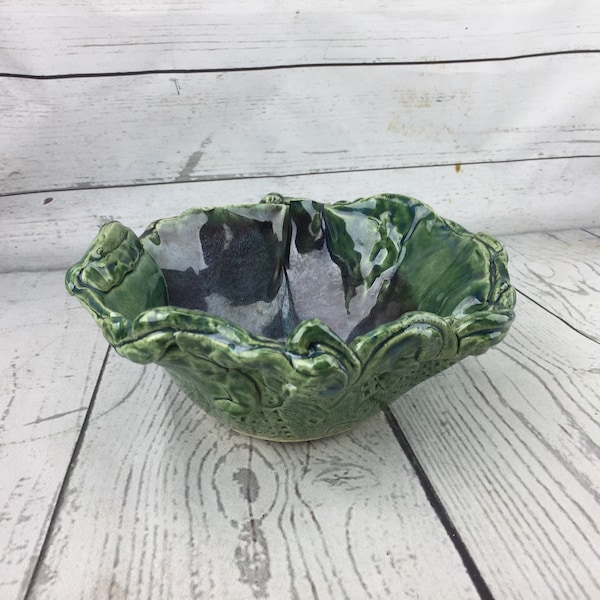
This screenshot has height=600, width=600. I want to click on wooden floor, so click(x=328, y=517).